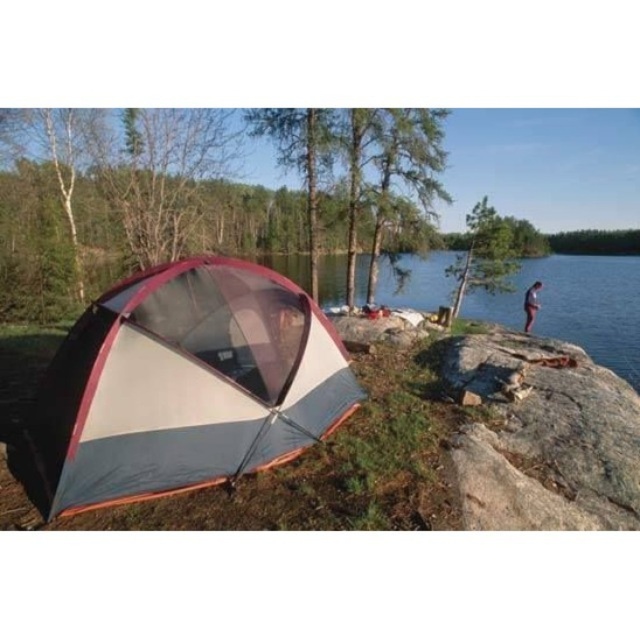
Does point (323, 376) come in front of point (483, 504)?

That is False.

Is point (330, 426) behind point (576, 352)?

No.

The width and height of the screenshot is (640, 640). Identify the location of multicolored fabric tent at left. (186, 385).

Is gray rough rock at right to the right of light blue jeans at right from the viewer's perspective?

No, gray rough rock at right is not to the right of light blue jeans at right.

Is point (460, 380) in front of point (529, 308)?

Yes, point (460, 380) is in front of point (529, 308).

The image size is (640, 640). What do you see at coordinates (544, 438) in the screenshot? I see `gray rough rock at right` at bounding box center [544, 438].

Find the location of `gray rough rock at right`. gray rough rock at right is located at coordinates (544, 438).

How distant is multicolored fabric tent at left from light blue jeans at right?

multicolored fabric tent at left and light blue jeans at right are 14.52 meters apart from each other.

Which is in front, point (161, 266) or point (534, 282)?

Point (161, 266) is in front.

Who is more distant from viewer, (x=140, y=442) or (x=531, y=308)?

The point (x=531, y=308) is more distant.

The width and height of the screenshot is (640, 640). In order to click on multicolored fabric tent at left in this screenshot , I will do `click(186, 385)`.